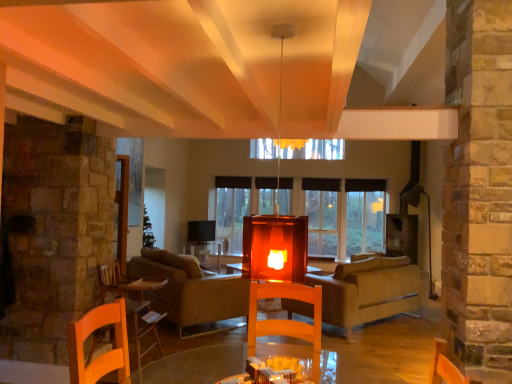
Question: Is beige fabric couch at center outside of velvet beige couch at center?

Choices:
 (A) no
 (B) yes

Answer: (B)

Question: From the image's perspective, would you say beige fabric couch at center is shown under velvet beige couch at center?

Choices:
 (A) yes
 (B) no

Answer: (A)

Question: From a real-world perspective, is beige fabric couch at center over velvet beige couch at center?

Choices:
 (A) yes
 (B) no

Answer: (A)

Question: Is beige fabric couch at center touching velvet beige couch at center?

Choices:
 (A) yes
 (B) no

Answer: (B)

Question: From a real-world perspective, is beige fabric couch at center below velvet beige couch at center?

Choices:
 (A) yes
 (B) no

Answer: (B)

Question: From the image's perspective, is beige fabric couch at center above or below wooden table at lower left?

Choices:
 (A) above
 (B) below

Answer: (B)

Question: In terms of size, does beige fabric couch at center appear bigger or smaller than wooden table at lower left?

Choices:
 (A) big
 (B) small

Answer: (A)

Question: Is beige fabric couch at center taller or shorter than wooden table at lower left?

Choices:
 (A) short
 (B) tall

Answer: (A)

Question: From a real-world perspective, is beige fabric couch at center positioned above or below wooden table at lower left?

Choices:
 (A) above
 (B) below

Answer: (B)

Question: Does point (182, 326) appear closer or farther from the camera than point (135, 304)?

Choices:
 (A) farther
 (B) closer

Answer: (A)

Question: Considering the positions of velvet beige couch at center and wooden table at lower left in the image, is velvet beige couch at center bigger or smaller than wooden table at lower left?

Choices:
 (A) big
 (B) small

Answer: (A)

Question: Is velvet beige couch at center taller or shorter than wooden table at lower left?

Choices:
 (A) tall
 (B) short

Answer: (B)

Question: From the image's perspective, relative to wooden table at lower left, is velvet beige couch at center above or below?

Choices:
 (A) above
 (B) below

Answer: (B)

Question: Visually, is transparent glass window at center positioned to the left or to the right of velvet beige couch at center?

Choices:
 (A) left
 (B) right

Answer: (B)

Question: Is transparent glass window at center inside or outside of velvet beige couch at center?

Choices:
 (A) inside
 (B) outside

Answer: (B)